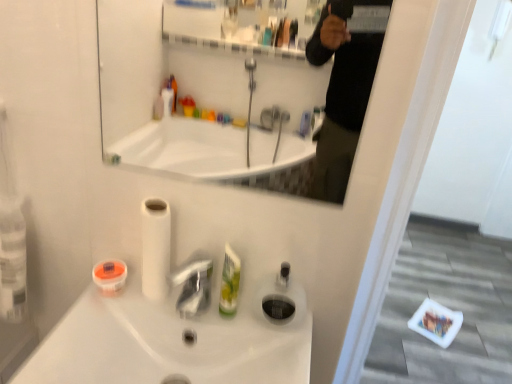
The width and height of the screenshot is (512, 384). I want to click on vacant region to the left of green plastic mouthwash at center, which is counted as the second mouthwash, starting from the left, so click(165, 317).